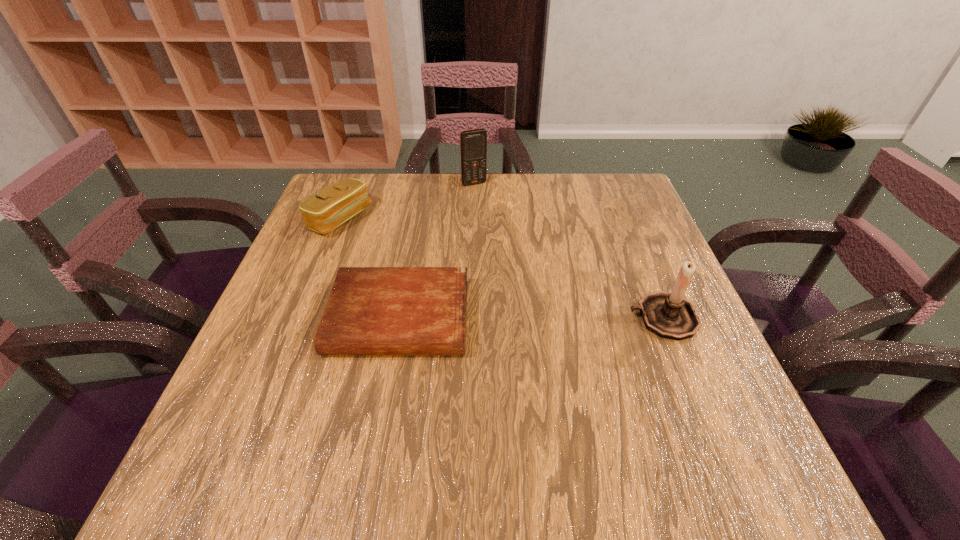
Locate an element on the screen. vacant space on the desktop that is between the shortest object and the rightmost object and is positioned on the screen of the farthest object is located at coordinates (557, 318).

Image resolution: width=960 pixels, height=540 pixels. In order to click on free space on the desktop that is between the shortest object and the candle holder and is positioned on the zipper side of the third tallest object in this screenshot , I will do `click(517, 318)`.